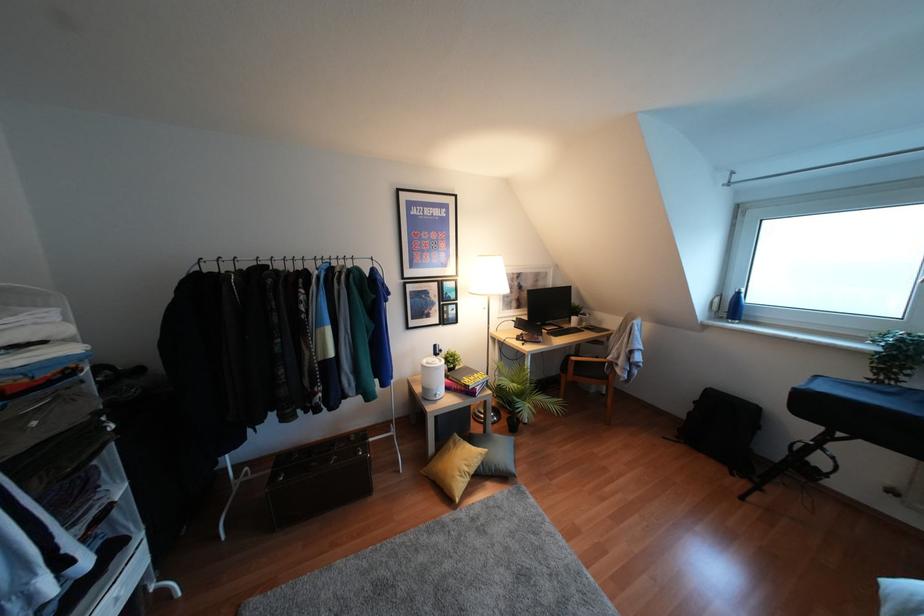
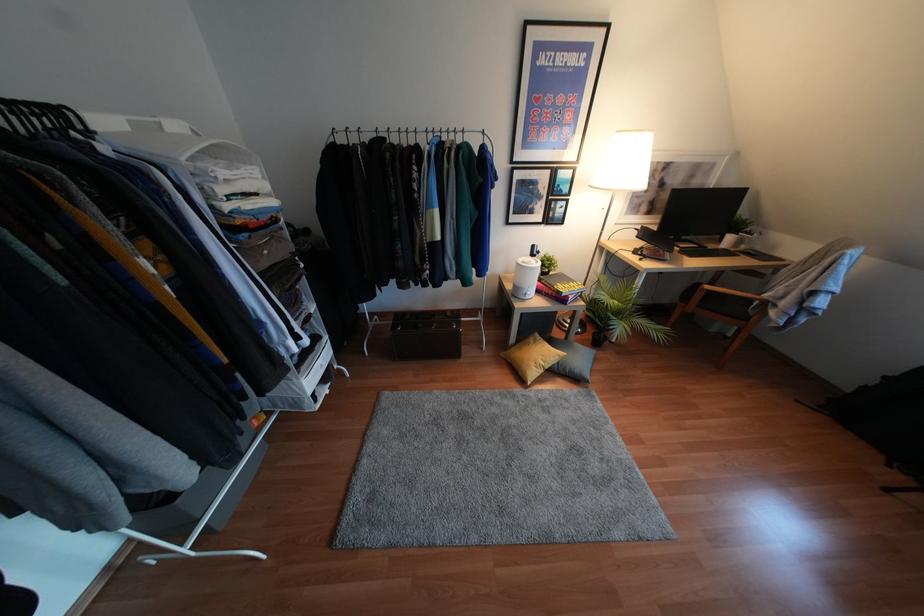
The point at (466, 469) is marked in the first image. Where is the corresponding point in the second image?

(541, 363)